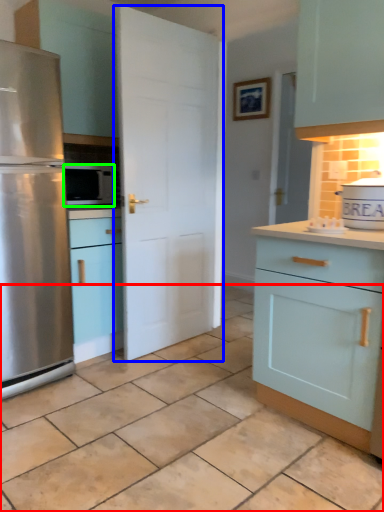
Question: Which is farther away from tile (highlighted by a red box)? door (highlighted by a blue box) or microwave oven (highlighted by a green box)?

Choices:
 (A) door
 (B) microwave oven

Answer: (B)